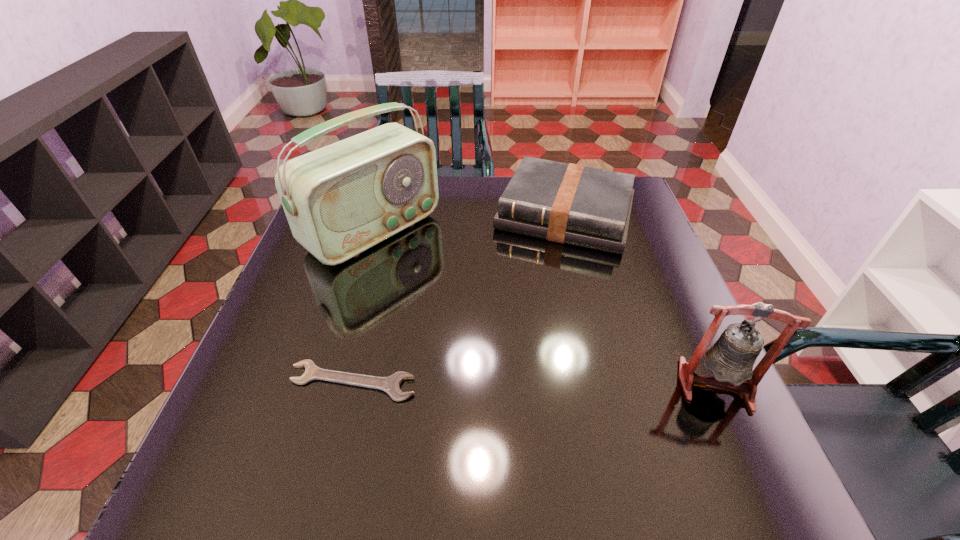
Where is `free space on the desktop that is between the wrench and the bell and is positioned on the front panel of the tallest object`? Image resolution: width=960 pixels, height=540 pixels. free space on the desktop that is between the wrench and the bell and is positioned on the front panel of the tallest object is located at coordinates 587,384.

Find the location of a particular element. This screenshot has width=960, height=540. vacant space on the desktop that is between the wrench and the bell and is positioned on the spine side of the hardback book is located at coordinates (507, 383).